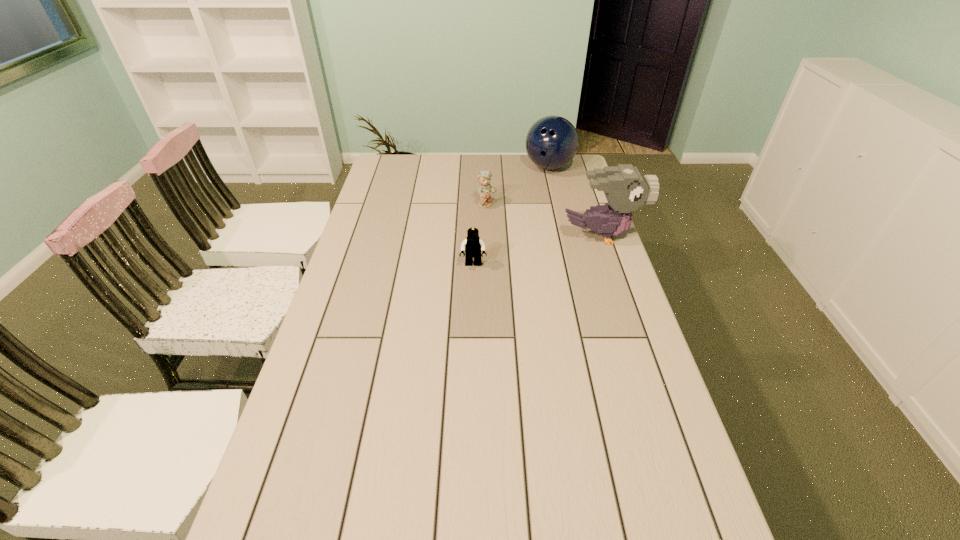
The image size is (960, 540). Find the location of `vacant space located on the surface of the bowling ball near the finger holes`. vacant space located on the surface of the bowling ball near the finger holes is located at coordinates (547, 226).

The image size is (960, 540). Identify the location of object at the far edge. (551, 143).

Where is `bird at the right edge`? This screenshot has width=960, height=540. bird at the right edge is located at coordinates (626, 189).

This screenshot has height=540, width=960. In order to click on bowling ball that is at the right edge in this screenshot , I will do `click(551, 143)`.

Find the location of `object positioned at the far right corner`. object positioned at the far right corner is located at coordinates (551, 143).

This screenshot has height=540, width=960. In the image, there is a desktop. Find the location of `vacant area at the left edge`. vacant area at the left edge is located at coordinates (379, 196).

What are the coordinates of `vacant region at the right edge of the desktop` in the screenshot? It's located at (563, 197).

At what (x,y) coordinates should I click in order to perform the action: click on vacant region at the far right corner of the desktop. Please return your answer as a coordinate pair (x, y). Looking at the image, I should click on (549, 176).

This screenshot has width=960, height=540. Identify the location of free area in between the nearest object and the farthest object. (511, 215).

At what (x,y) coordinates should I click in order to perform the action: click on empty space that is in between the second nearest object and the Lego. Please return your answer as a coordinate pair (x, y). Looking at the image, I should click on (537, 251).